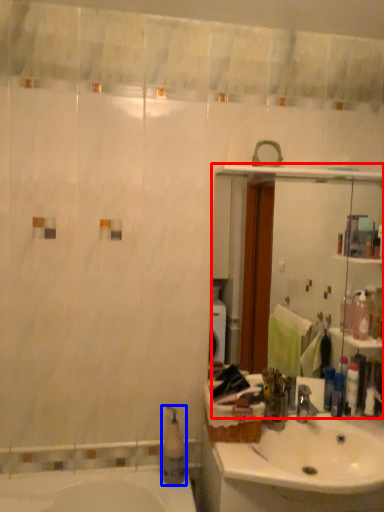
Question: Which of the following is the closest to the observer, mirror (highlighted by a red box) or soap dispenser (highlighted by a blue box)?

Choices:
 (A) mirror
 (B) soap dispenser

Answer: (B)